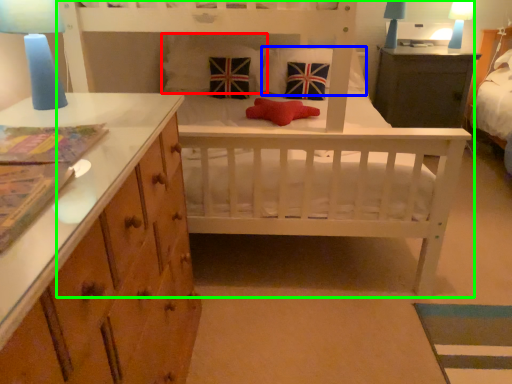
Question: Considering the real-world distances, which object is closest to pillow (highlighted by a red box)? pillow (highlighted by a blue box) or infant bed (highlighted by a green box).

Choices:
 (A) pillow
 (B) infant bed

Answer: (A)